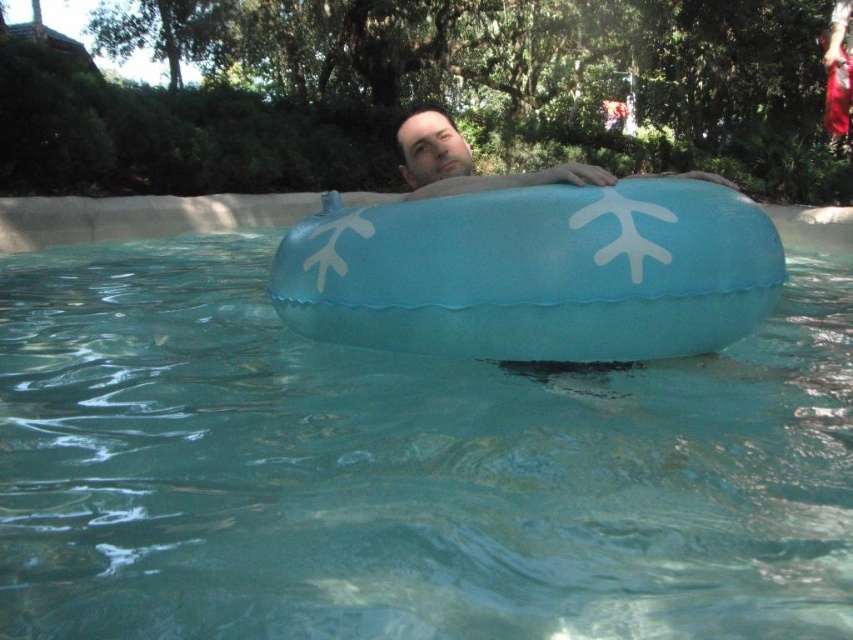
You are a swimmer who wants to retrieve both the blue rubber ring at center and the matte blue float at center from the pool. If you are currently at the edge of the pool, which object should you swim to first to minimize the total distance traveled?

You should swim to the blue rubber ring at center first because it is closer to the edge of the pool than the matte blue float at center, as the distance between them is 2.59 meters.

You are a lifeguard on duty and need to locate the blue rubber ring at center and the matte blue float at center in the pool. According to the scene, which object is positioned to the right side?

The blue rubber ring at center is to the right of the matte blue float at center, so the blue rubber ring at center is positioned to the right side.